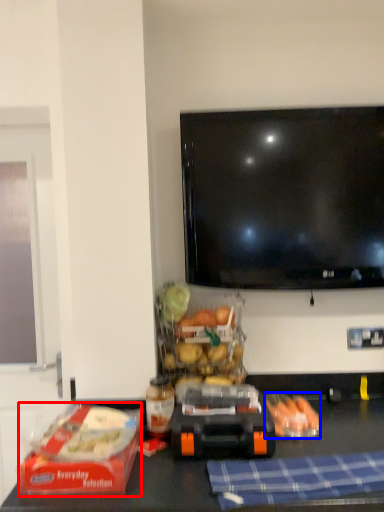
Question: Which of the following is the farthest to the observer, lunch box (highlighted by a red box) or food (highlighted by a blue box)?

Choices:
 (A) lunch box
 (B) food

Answer: (B)